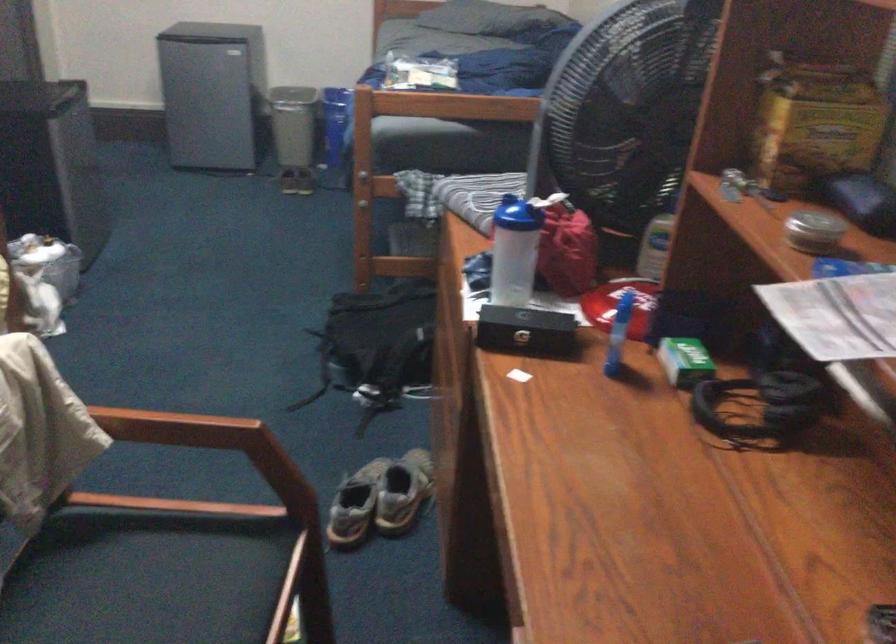
You are a GUI agent. You are given a task and a screenshot of the screen. Output one action in this format:
    pyautogui.click(x=<x>, y=<y>)
    Task: Click on the small green box
    
    Given the screenshot: What is the action you would take?
    pyautogui.click(x=685, y=361)